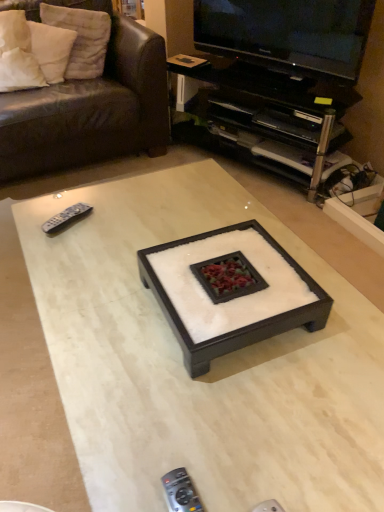
Question: From the image's perspective, does white cotton pillow at upper left, placed as the 1th pillow when sorted from right to left, appear lower than black plastic remote control at lower center, which is the first remote control from right to left?

Choices:
 (A) yes
 (B) no

Answer: (B)

Question: From a real-world perspective, is white cotton pillow at upper left, placed as the 1th pillow when sorted from right to left, located higher than black plastic remote control at lower center, which is the first remote control from right to left?

Choices:
 (A) yes
 (B) no

Answer: (A)

Question: Is the position of white cotton pillow at upper left, placed as the 1th pillow when sorted from right to left, more distant than that of black plastic remote control at lower center, placed as the 1th remote control when sorted from front to back?

Choices:
 (A) no
 (B) yes

Answer: (B)

Question: Is black plastic remote control at lower center, which is the first remote control from bottom to top, at the back of white cotton pillow at upper left, the second pillow in the left-to-right sequence?

Choices:
 (A) no
 (B) yes

Answer: (A)

Question: Is black plastic remote control at lower center, which is the first remote control from bottom to top, completely or partially inside white cotton pillow at upper left, the second pillow in the left-to-right sequence?

Choices:
 (A) yes
 (B) no

Answer: (B)

Question: Is white cotton pillow at upper left, the second pillow in the left-to-right sequence, facing towards black plastic remote control at lower center, placed as the 1th remote control when sorted from front to back?

Choices:
 (A) yes
 (B) no

Answer: (A)

Question: Is black plastic remote control at lower center, which is the second remote control from back to front, completely or partially inside gray plastic remote at left, the first remote control viewed from the left?

Choices:
 (A) yes
 (B) no

Answer: (B)

Question: From the image's perspective, does gray plastic remote at left, acting as the 2th remote control starting from the front, appear lower than black plastic remote control at lower center, which is the first remote control from right to left?

Choices:
 (A) yes
 (B) no

Answer: (B)

Question: Considering the relative positions of gray plastic remote at left, marked as the first remote control in a top-to-bottom arrangement, and black plastic remote control at lower center, which is the first remote control from right to left, in the image provided, is gray plastic remote at left, marked as the first remote control in a top-to-bottom arrangement, to the right of black plastic remote control at lower center, which is the first remote control from right to left, from the viewer's perspective?

Choices:
 (A) yes
 (B) no

Answer: (B)

Question: Considering the relative sizes of gray plastic remote at left, marked as the first remote control in a top-to-bottom arrangement, and black plastic remote control at lower center, which is the second remote control from back to front, in the image provided, is gray plastic remote at left, marked as the first remote control in a top-to-bottom arrangement, wider than black plastic remote control at lower center, which is the second remote control from back to front,?

Choices:
 (A) yes
 (B) no

Answer: (A)

Question: From a real-world perspective, is gray plastic remote at left, the second remote control from the right, on top of black plastic remote control at lower center, placed as the 1th remote control when sorted from front to back?

Choices:
 (A) yes
 (B) no

Answer: (B)

Question: Is gray plastic remote at left, marked as the first remote control in a back-to-front arrangement, in contact with black plastic remote control at lower center, the second remote control positioned from the top?

Choices:
 (A) no
 (B) yes

Answer: (A)

Question: Can you confirm if white soft pillow at upper left, the first pillow in the left-to-right sequence, is thinner than leather couch at upper left?

Choices:
 (A) yes
 (B) no

Answer: (A)